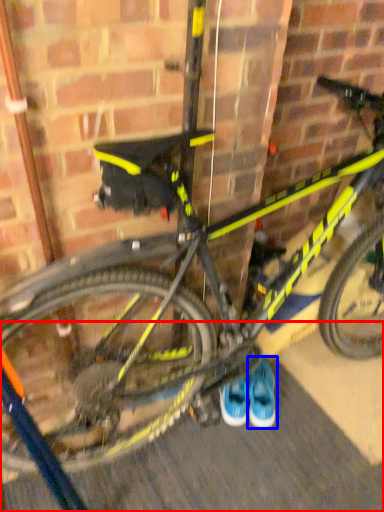
Question: Among these objects, which one is farthest to the camera, pavement (highlighted by a red box) or footwear (highlighted by a blue box)?

Choices:
 (A) pavement
 (B) footwear

Answer: (B)